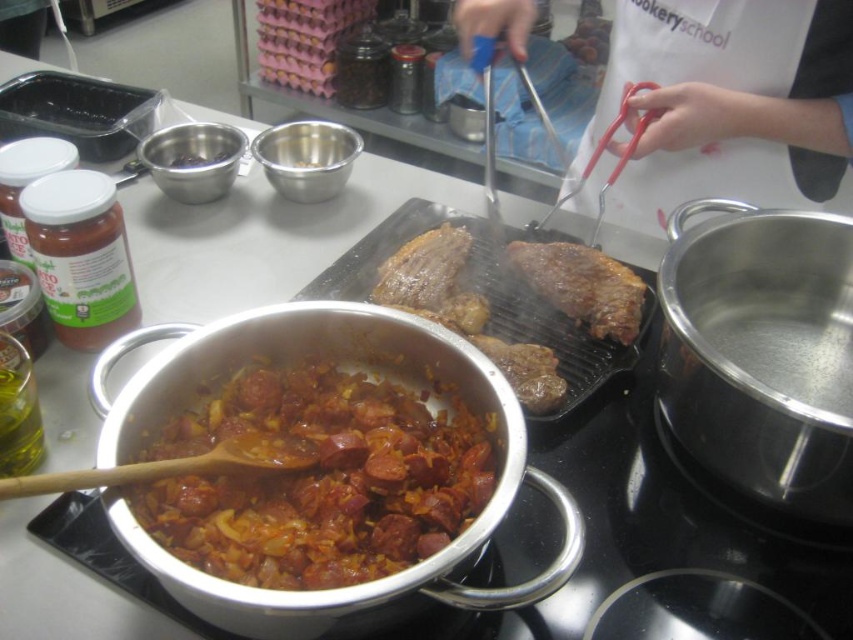
Which of these two, brown glossy sausages at center or blue plastic tongs at center, stands shorter?

Standing shorter between the two is brown glossy sausages at center.

Image resolution: width=853 pixels, height=640 pixels. What do you see at coordinates (320, 480) in the screenshot? I see `brown glossy sausages at center` at bounding box center [320, 480].

What do you see at coordinates (320, 480) in the screenshot?
I see `brown glossy sausages at center` at bounding box center [320, 480].

Locate an element on the screen. The image size is (853, 640). brown glossy sausages at center is located at coordinates (320, 480).

Is brown glossy sausages at center smaller than metallic bowl at upper left?

Actually, brown glossy sausages at center might be larger than metallic bowl at upper left.

Between point (380, 554) and point (189, 157), which one is positioned in front?

Point (380, 554)

This screenshot has height=640, width=853. Find the location of `brown glossy sausages at center`. brown glossy sausages at center is located at coordinates (320, 480).

Between blue plastic tongs at center and metallic bowl at upper left, which one has less height?

With less height is metallic bowl at upper left.

Based on the photo, does blue plastic tongs at center appear on the right side of metallic bowl at upper left?

Correct, you'll find blue plastic tongs at center to the right of metallic bowl at upper left.

Between point (726, 109) and point (194, 161), which one is positioned behind?

The point (194, 161) is more distant.

Image resolution: width=853 pixels, height=640 pixels. Find the location of `blue plastic tongs at center`. blue plastic tongs at center is located at coordinates (730, 104).